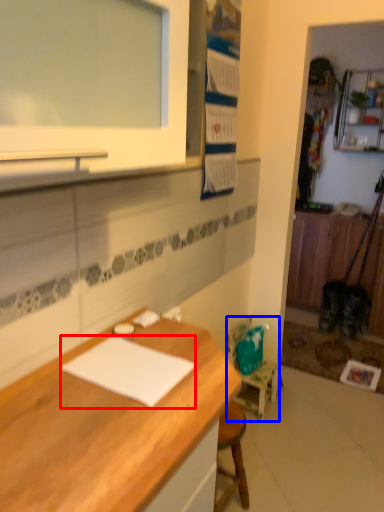
Question: Which object is further to the camera taking this photo, notepad (highlighted by a red box) or chair (highlighted by a blue box)?

Choices:
 (A) notepad
 (B) chair

Answer: (B)